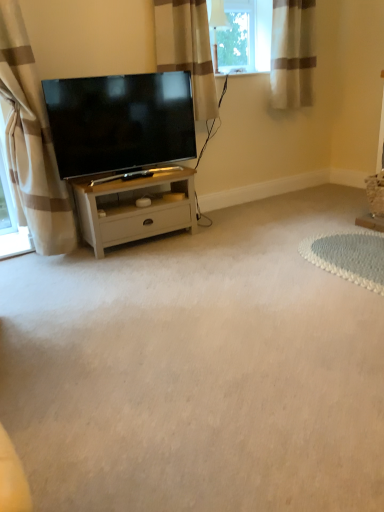
The width and height of the screenshot is (384, 512). In order to click on vacant space to the right of beige striped curtain at left, the 1th curtain in the left-to-right sequence in this screenshot , I will do `click(85, 265)`.